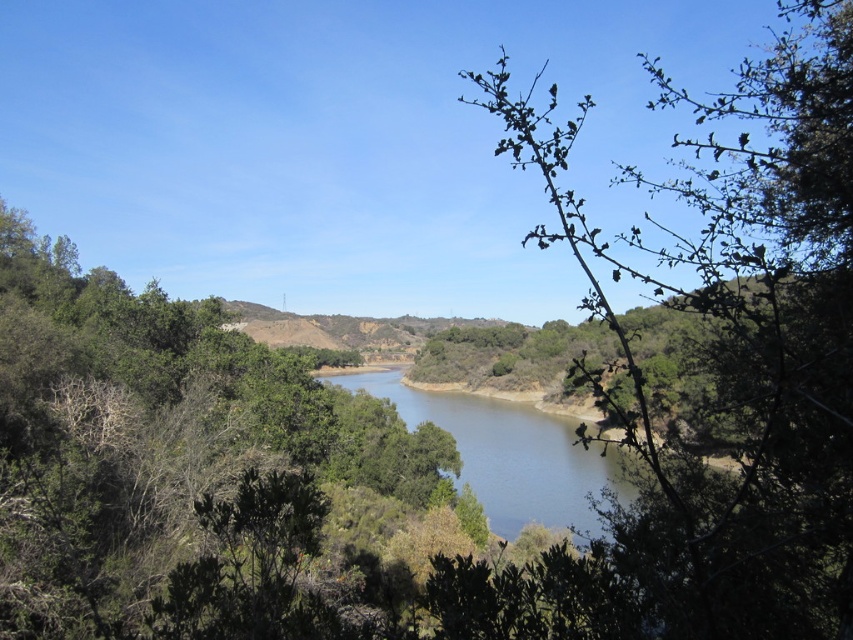
Please look at the point marked at coordinates (721, 385). What object is located there?

The green leafy branch at center is located at point (721, 385).

You are standing in the natural landscape scene and want to pick up the green leafy branch at center and the blue smooth water at center. Which object can you physically touch first without moving from your current position?

The green leafy branch at center is closer to the viewer than the blue smooth water at center, so you can touch the green leafy branch at center first without moving.